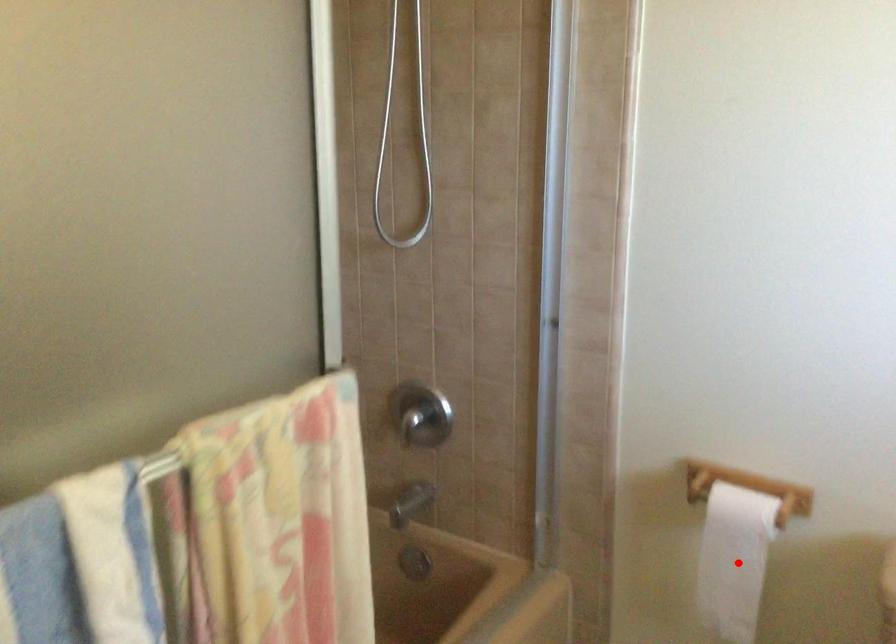
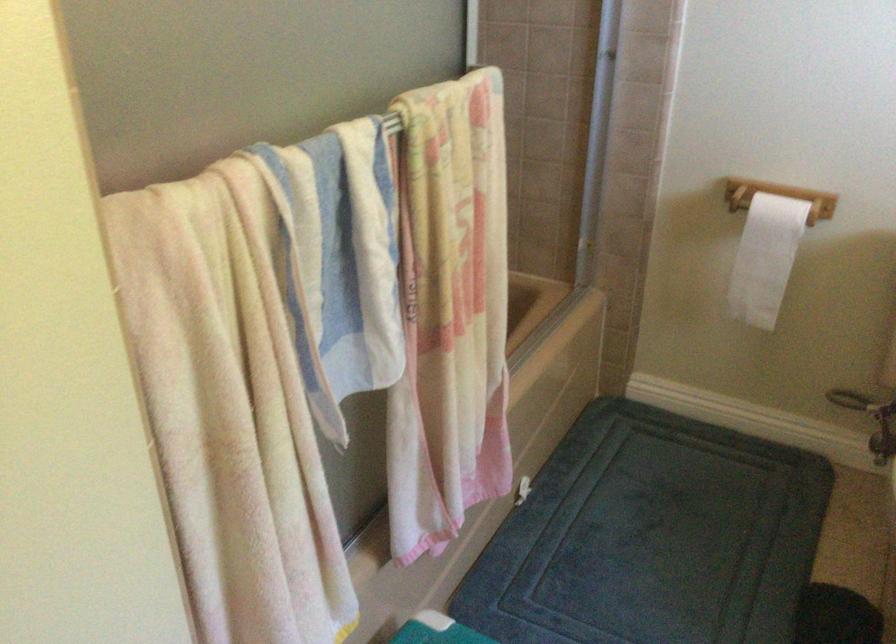
Locate, in the second image, the point that corresponds to the highlighted location in the first image.

(764, 258)